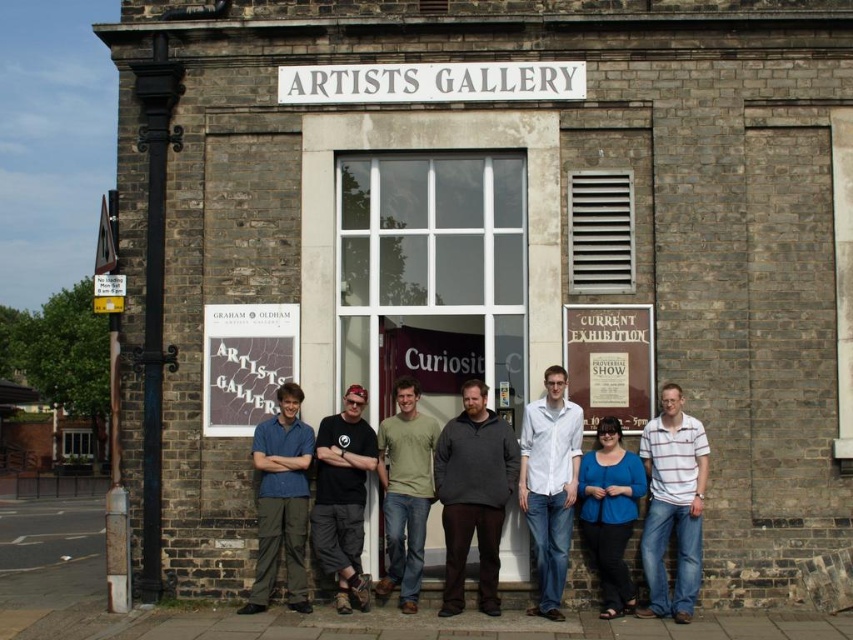
Does white striped shirt at center have a greater width compared to matte blue shirt at center?

No.

Does white striped shirt at center appear on the right side of matte blue shirt at center?

Yes, white striped shirt at center is to the right of matte blue shirt at center.

Who is more distant from viewer, (x=564, y=573) or (x=289, y=531)?

The point (x=289, y=531) is more distant.

Where is `white striped shirt at center`? white striped shirt at center is located at coordinates [549, 484].

Does dark gray sweater at center have a larger size compared to wooden signboard at center?

Yes, dark gray sweater at center is bigger than wooden signboard at center.

Who is shorter, dark gray sweater at center or wooden signboard at center?

wooden signboard at center is shorter.

Where is `dark gray sweater at center`? dark gray sweater at center is located at coordinates (473, 496).

Consider the image. Between white striped polo shirt at center and green matte t-shirt at center, which one is positioned lower?

white striped polo shirt at center is lower down.

Who is higher up, white striped polo shirt at center or green matte t-shirt at center?

Positioned higher is green matte t-shirt at center.

Is point (677, 474) behind point (418, 493)?

No, (677, 474) is closer to viewer.

The image size is (853, 640). Find the location of `white striped polo shirt at center`. white striped polo shirt at center is located at coordinates (672, 504).